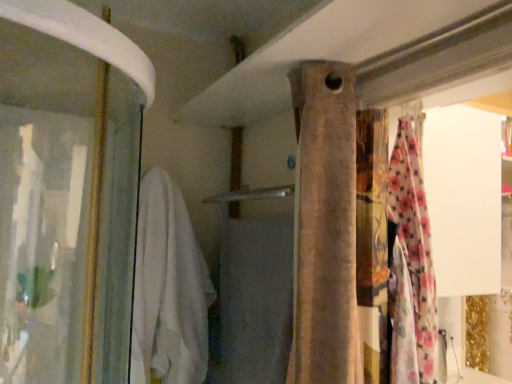
Question: Is white soft towel at left positioned with its back to beige fabric curtain at center?

Choices:
 (A) yes
 (B) no

Answer: (B)

Question: From a real-world perspective, does white soft towel at left stand above beige fabric curtain at center?

Choices:
 (A) no
 (B) yes

Answer: (A)

Question: Does white soft towel at left have a smaller size compared to beige fabric curtain at center?

Choices:
 (A) yes
 (B) no

Answer: (B)

Question: Considering the relative sizes of white soft towel at left and beige fabric curtain at center in the image provided, is white soft towel at left shorter than beige fabric curtain at center?

Choices:
 (A) no
 (B) yes

Answer: (A)

Question: Is white soft towel at left in contact with beige fabric curtain at center?

Choices:
 (A) no
 (B) yes

Answer: (A)

Question: Is white soft towel at left positioned far away from beige fabric curtain at center?

Choices:
 (A) yes
 (B) no

Answer: (B)

Question: Is beige fabric curtain at center aimed at white soft towel at center?

Choices:
 (A) yes
 (B) no

Answer: (B)

Question: Is beige fabric curtain at center behind white soft towel at center?

Choices:
 (A) yes
 (B) no

Answer: (B)

Question: Can you confirm if beige fabric curtain at center is thinner than white soft towel at center?

Choices:
 (A) no
 (B) yes

Answer: (A)

Question: Considering the relative positions of beige fabric curtain at center and white soft towel at center in the image provided, is beige fabric curtain at center to the right of white soft towel at center from the viewer's perspective?

Choices:
 (A) yes
 (B) no

Answer: (A)

Question: Can you see beige fabric curtain at center touching white soft towel at center?

Choices:
 (A) no
 (B) yes

Answer: (A)

Question: Would you consider beige fabric curtain at center to be distant from white soft towel at center?

Choices:
 (A) yes
 (B) no

Answer: (B)

Question: Considering the relative sizes of beige fabric curtain at center and white soft towel at left in the image provided, is beige fabric curtain at center taller than white soft towel at left?

Choices:
 (A) no
 (B) yes

Answer: (A)